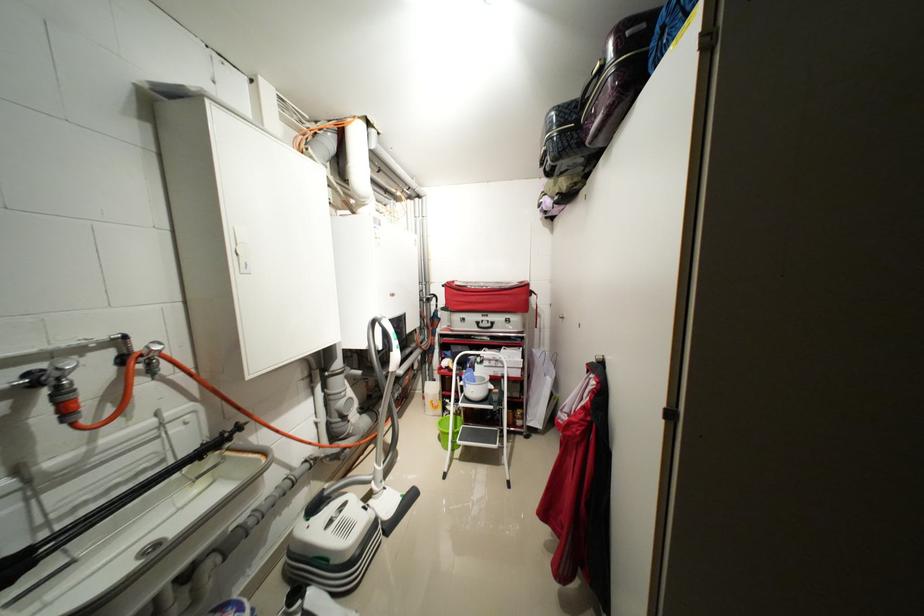
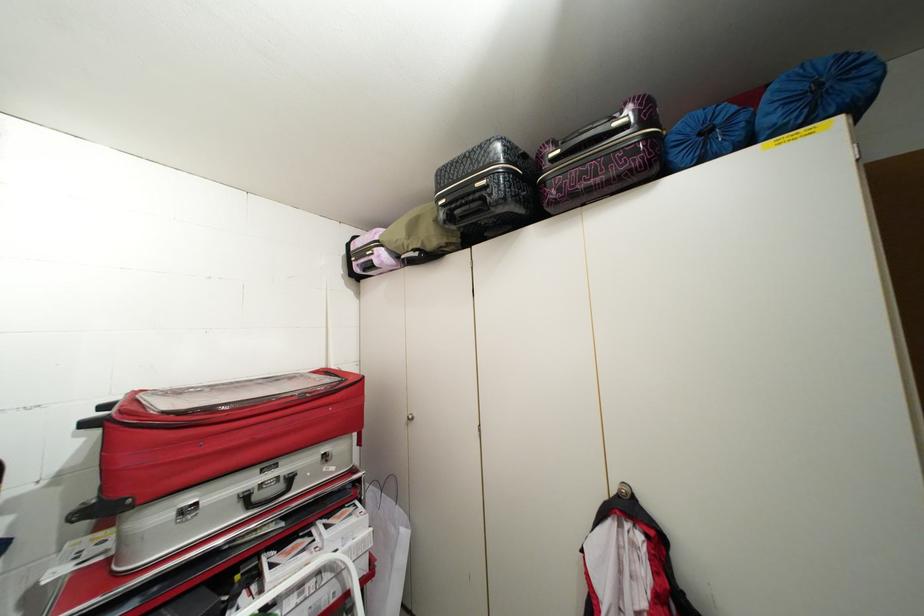
Locate, in the second image, the point that corresponds to point (496, 326) in the first image.

(287, 487)